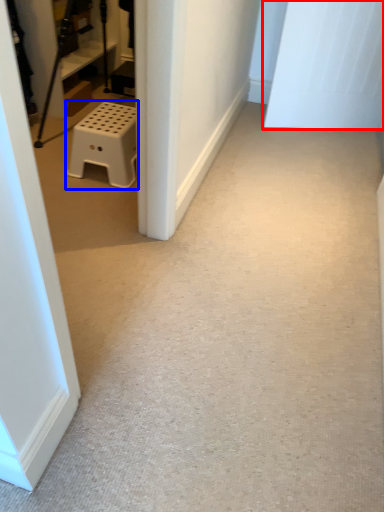
Question: Which object is further to the camera taking this photo, door (highlighted by a red box) or furniture (highlighted by a blue box)?

Choices:
 (A) door
 (B) furniture

Answer: (A)